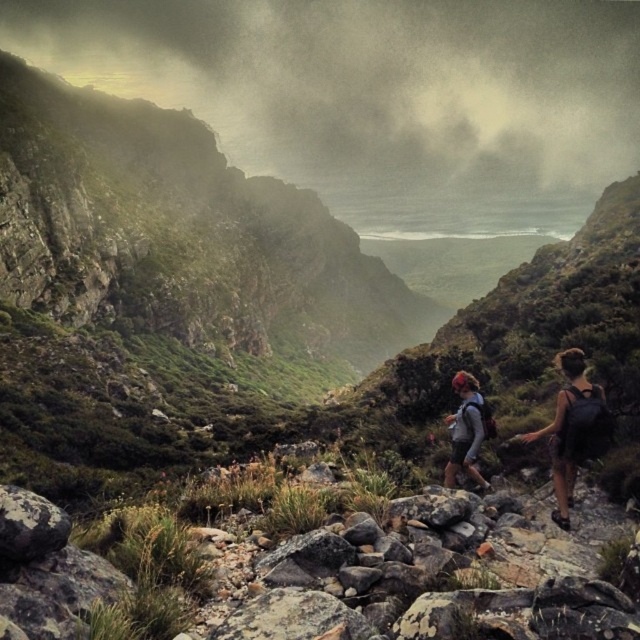
Is matte gray backpack at center shorter than speckled gray rock at lower left?

No.

Does matte gray backpack at center have a greater width compared to speckled gray rock at lower left?

Yes, matte gray backpack at center is wider than speckled gray rock at lower left.

Measure the distance between matte gray backpack at center and camera.

matte gray backpack at center and camera are 39.47 feet apart from each other.

Where is `matte gray backpack at center`? The width and height of the screenshot is (640, 640). matte gray backpack at center is located at coordinates (572, 429).

Between speckled gray rock at lower left and matte gray jacket at center, which one has less height?

matte gray jacket at center is shorter.

Is point (20, 504) farther from viewer compared to point (460, 432)?

No, it is in front of (460, 432).

This screenshot has width=640, height=640. Identify the location of speckled gray rock at lower left. (29, 525).

Does matte gray backpack at center have a greater width compared to matte gray jacket at center?

Correct, the width of matte gray backpack at center exceeds that of matte gray jacket at center.

Who is more forward, (564, 497) or (458, 435)?

Positioned in front is point (564, 497).

Find the location of a particular element. matte gray backpack at center is located at coordinates (572, 429).